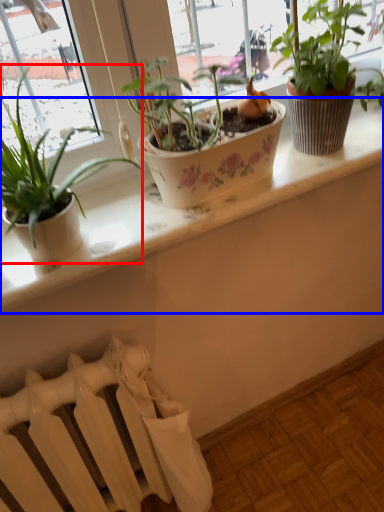
Question: Which of the following is the closest to the observer, houseplant (highlighted by a red box) or window sill (highlighted by a blue box)?

Choices:
 (A) houseplant
 (B) window sill

Answer: (A)